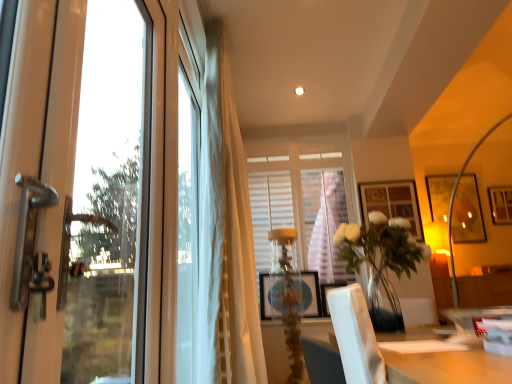
Where is `empty space that is ontop of white matte window at center, arranged as the 2th window when viewed from the front (from a real-world perspective)`? This screenshot has width=512, height=384. empty space that is ontop of white matte window at center, arranged as the 2th window when viewed from the front (from a real-world perspective) is located at coordinates (294, 130).